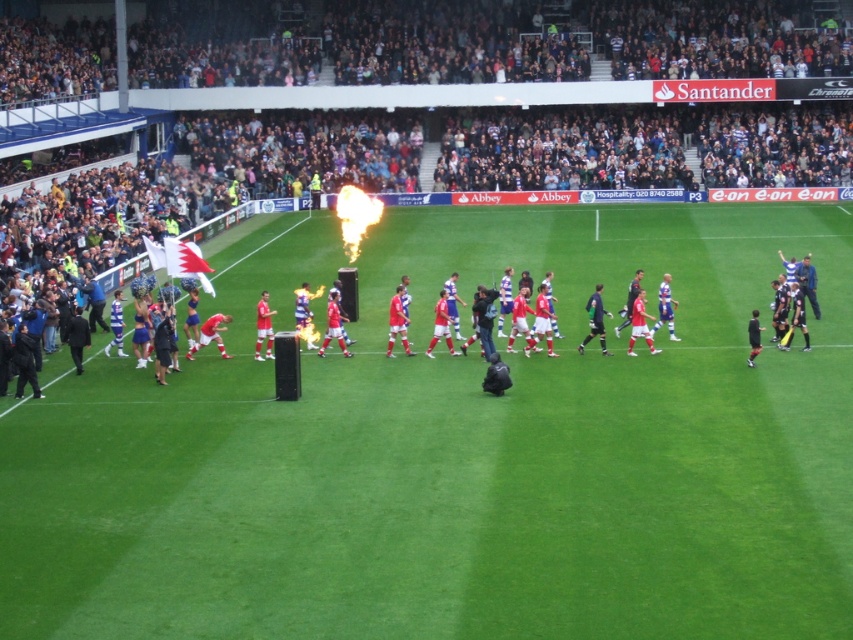
Question: Is green grass field at center wider than smooth plastic flag at upper left?

Choices:
 (A) yes
 (B) no

Answer: (B)

Question: Is green grass field at center closer to camera compared to smooth plastic flag at upper left?

Choices:
 (A) yes
 (B) no

Answer: (A)

Question: Among these points, which one is farthest from the camera?

Choices:
 (A) (352, 8)
 (B) (747, 385)

Answer: (A)

Question: Which object appears farthest from the camera in this image?

Choices:
 (A) green grass field at center
 (B) smooth plastic flag at upper left

Answer: (B)

Question: Does green grass field at center lie behind smooth plastic flag at upper left?

Choices:
 (A) yes
 (B) no

Answer: (B)